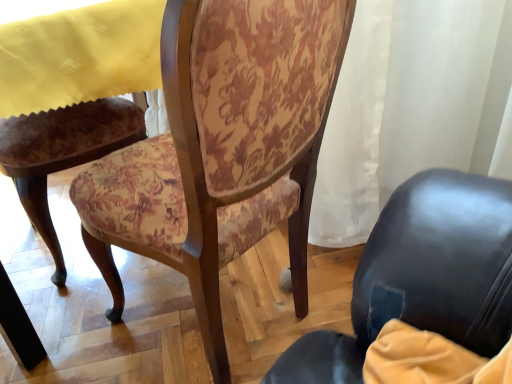
Question: Is yellow fabric at upper left not within floral fabric chair at center?

Choices:
 (A) no
 (B) yes

Answer: (B)

Question: Is yellow fabric at upper left to the left of floral fabric chair at center from the viewer's perspective?

Choices:
 (A) yes
 (B) no

Answer: (A)

Question: Can you confirm if yellow fabric at upper left is smaller than floral fabric chair at center?

Choices:
 (A) no
 (B) yes

Answer: (B)

Question: Can you confirm if yellow fabric at upper left is shorter than floral fabric chair at center?

Choices:
 (A) no
 (B) yes

Answer: (B)

Question: Is yellow fabric at upper left positioned behind floral fabric chair at center?

Choices:
 (A) yes
 (B) no

Answer: (A)

Question: Is yellow fabric at upper left bigger than floral fabric chair at center?

Choices:
 (A) no
 (B) yes

Answer: (A)

Question: Is the depth of floral fabric chair at center less than that of yellow fabric at upper left?

Choices:
 (A) yes
 (B) no

Answer: (A)

Question: Can you confirm if floral fabric chair at center is positioned to the left of yellow fabric at upper left?

Choices:
 (A) no
 (B) yes

Answer: (A)

Question: Considering the relative sizes of floral fabric chair at center and yellow fabric at upper left in the image provided, is floral fabric chair at center bigger than yellow fabric at upper left?

Choices:
 (A) no
 (B) yes

Answer: (B)

Question: From a real-world perspective, is floral fabric chair at center located higher than yellow fabric at upper left?

Choices:
 (A) yes
 (B) no

Answer: (B)

Question: Considering the relative sizes of floral fabric chair at center and yellow fabric at upper left in the image provided, is floral fabric chair at center smaller than yellow fabric at upper left?

Choices:
 (A) no
 (B) yes

Answer: (A)

Question: Is floral fabric chair at center shorter than yellow fabric at upper left?

Choices:
 (A) no
 (B) yes

Answer: (A)

Question: Relative to yellow fabric at upper left, is floral fabric chair at center in front or behind?

Choices:
 (A) behind
 (B) front

Answer: (B)